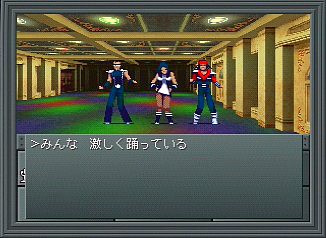
Locate an element on the screen. The width and height of the screenshot is (326, 238). wall to the right of people is located at coordinates [35, 91].